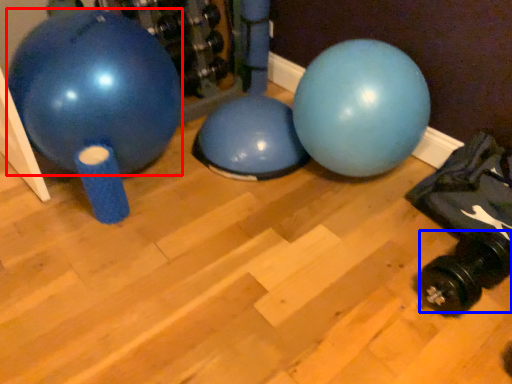
Question: Which of the following is the farthest to the observer, ball (highlighted by a red box) or dumbbell (highlighted by a blue box)?

Choices:
 (A) ball
 (B) dumbbell

Answer: (A)